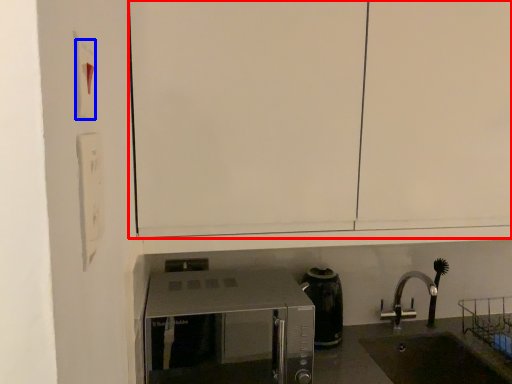
Question: Which of the following is the closest to the observer, cabinetry (highlighted by a red box) or light switch (highlighted by a blue box)?

Choices:
 (A) cabinetry
 (B) light switch

Answer: (B)